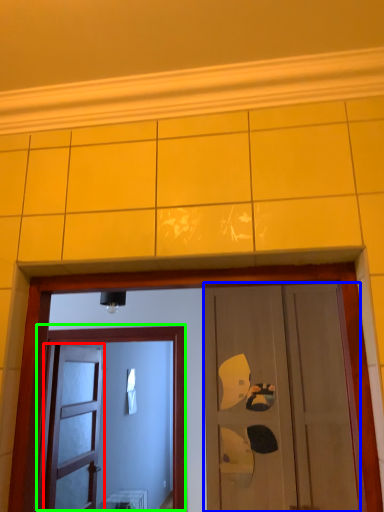
Question: Estimate the real-world distances between objects in this image. Which object is closer to door (highlighted by a red box), door (highlighted by a blue box) or door (highlighted by a green box)?

Choices:
 (A) door
 (B) door

Answer: (B)